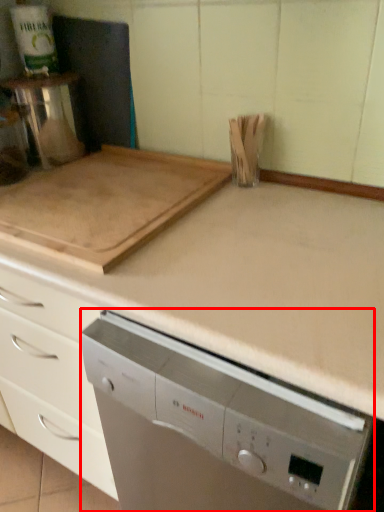
Question: From the image's perspective, what is the correct spatial relationship of home appliance (annotated by the red box) in relation to kitchen appliance?

Choices:
 (A) above
 (B) below

Answer: (B)